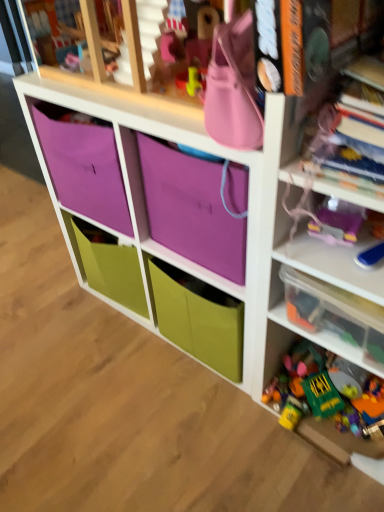
Question: Is purple fabric bag at upper center positioned beyond the bounds of purple fabric storage at center?

Choices:
 (A) yes
 (B) no

Answer: (B)

Question: Is purple fabric bag at upper center smaller than purple fabric storage at center?

Choices:
 (A) yes
 (B) no

Answer: (A)

Question: Considering the relative sizes of purple fabric bag at upper center and purple fabric storage at center in the image provided, is purple fabric bag at upper center taller than purple fabric storage at center?

Choices:
 (A) yes
 (B) no

Answer: (B)

Question: Is purple fabric storage at center at the back of purple fabric bag at upper center?

Choices:
 (A) yes
 (B) no

Answer: (A)

Question: Can you confirm if purple fabric bag at upper center is wider than purple fabric storage at center?

Choices:
 (A) yes
 (B) no

Answer: (B)

Question: Looking at the image, does purple fabric bag at upper center seem bigger or smaller compared to purple fabric storage at center?

Choices:
 (A) small
 (B) big

Answer: (A)

Question: Considering the positions of point (200, 216) and point (246, 388), is point (200, 216) closer or farther from the camera than point (246, 388)?

Choices:
 (A) closer
 (B) farther

Answer: (A)

Question: From their relative heights in the image, would you say purple fabric bag at upper center is taller or shorter than purple fabric storage at center?

Choices:
 (A) tall
 (B) short

Answer: (B)

Question: Relative to purple fabric storage at center, is purple fabric bag at upper center in front or behind?

Choices:
 (A) behind
 (B) front

Answer: (A)

Question: From the image's perspective, is purple fabric storage at center above or below translucent plastic toys at right?

Choices:
 (A) above
 (B) below

Answer: (A)

Question: Considering the positions of point (134, 201) and point (274, 39), is point (134, 201) closer or farther from the camera than point (274, 39)?

Choices:
 (A) closer
 (B) farther

Answer: (B)

Question: Relative to translucent plastic toys at right, is purple fabric storage at center in front or behind?

Choices:
 (A) behind
 (B) front

Answer: (A)

Question: Considering the positions of purple fabric storage at center and translucent plastic toys at right in the image, is purple fabric storage at center wider or thinner than translucent plastic toys at right?

Choices:
 (A) wide
 (B) thin

Answer: (B)

Question: Considering their positions, is clear plastic container at right located in front of or behind purple fabric bag at upper center?

Choices:
 (A) front
 (B) behind

Answer: (A)

Question: Considering the relative positions of clear plastic container at right and purple fabric bag at upper center in the image provided, is clear plastic container at right to the left or to the right of purple fabric bag at upper center?

Choices:
 (A) right
 (B) left

Answer: (A)